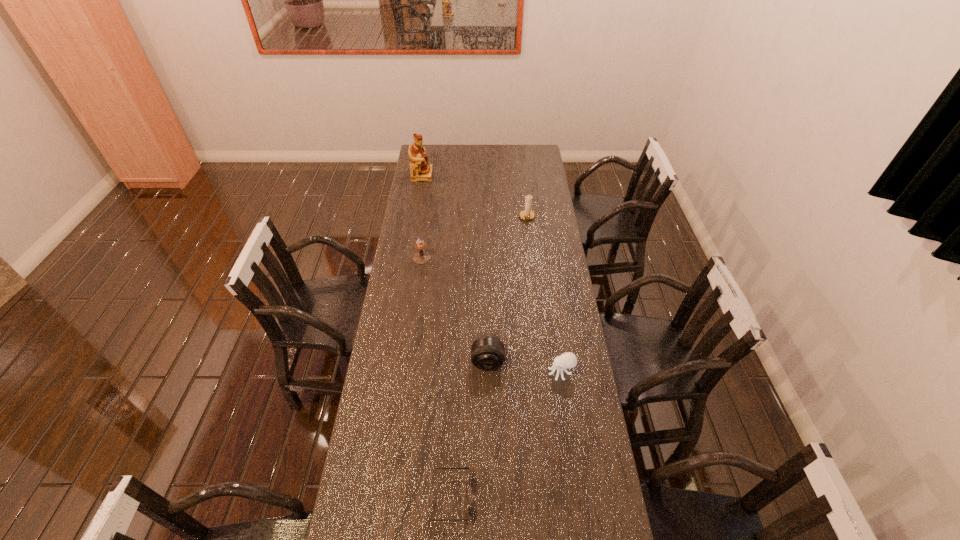
Where is `free space between the left candle holder and the sunglasses`? The image size is (960, 540). free space between the left candle holder and the sunglasses is located at coordinates (437, 377).

This screenshot has width=960, height=540. Identify the location of unoccupied position between the telephoto lens and the figurine. (455, 268).

The image size is (960, 540). I want to click on vacant point located between the second farthest object and the octopus, so click(544, 294).

Identify the location of free point between the sunglasses and the telephoto lens. (469, 429).

Where is `the third closest object to the nearer candle holder`? The height and width of the screenshot is (540, 960). the third closest object to the nearer candle holder is located at coordinates (421, 170).

You are a GUI agent. You are given a task and a screenshot of the screen. Output one action in this format:
    pyautogui.click(x=<x>, y=<y>)
    Task: Click on the second closest object to the farthest object
    This screenshot has width=960, height=540.
    Given the screenshot: What is the action you would take?
    pyautogui.click(x=421, y=257)

Where is `free space that satisfies the following two spatial constraints: 1. on the back side of the nearer candle holder; 2. on the front-facing side of the farthest object`? The height and width of the screenshot is (540, 960). free space that satisfies the following two spatial constraints: 1. on the back side of the nearer candle holder; 2. on the front-facing side of the farthest object is located at coordinates (433, 175).

Locate an element on the screen. The height and width of the screenshot is (540, 960). vacant area that satisfies the following two spatial constraints: 1. on the handle side of the right candle holder; 2. on the front-facing side of the shortest object is located at coordinates 561,497.